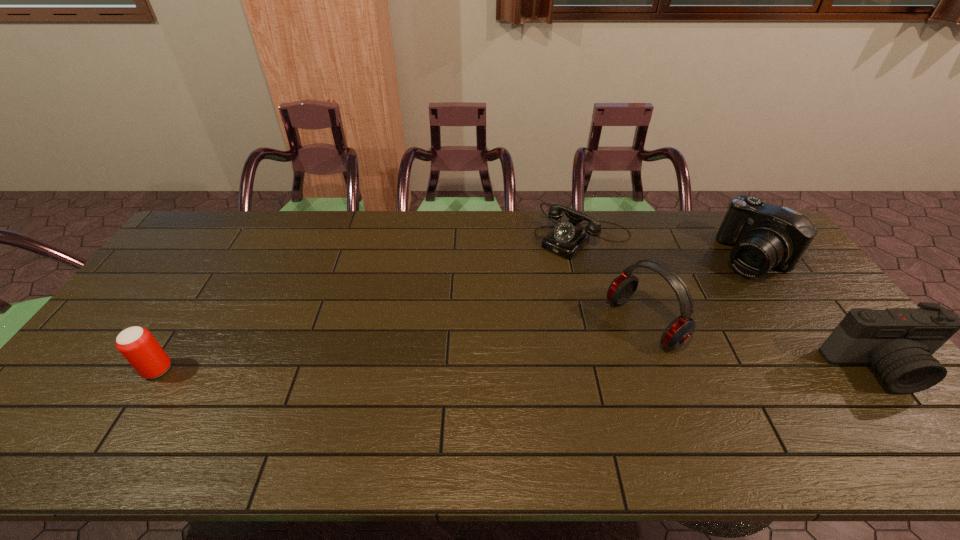
Locate an element on the screen. The image size is (960, 540). free space on the desktop that is between the leftmost object and the nearer camera and is positioned on the ear cups of the earphone is located at coordinates (566, 369).

The width and height of the screenshot is (960, 540). I want to click on free space on the desktop that is between the leftmost object and the nearer camera and is positioned on the front-facing side of the telephone, so click(x=449, y=369).

Locate an element on the screen. free space on the desktop that is between the second shortest object and the nearer camera and is positioned on the lens of the farther camera is located at coordinates (612, 369).